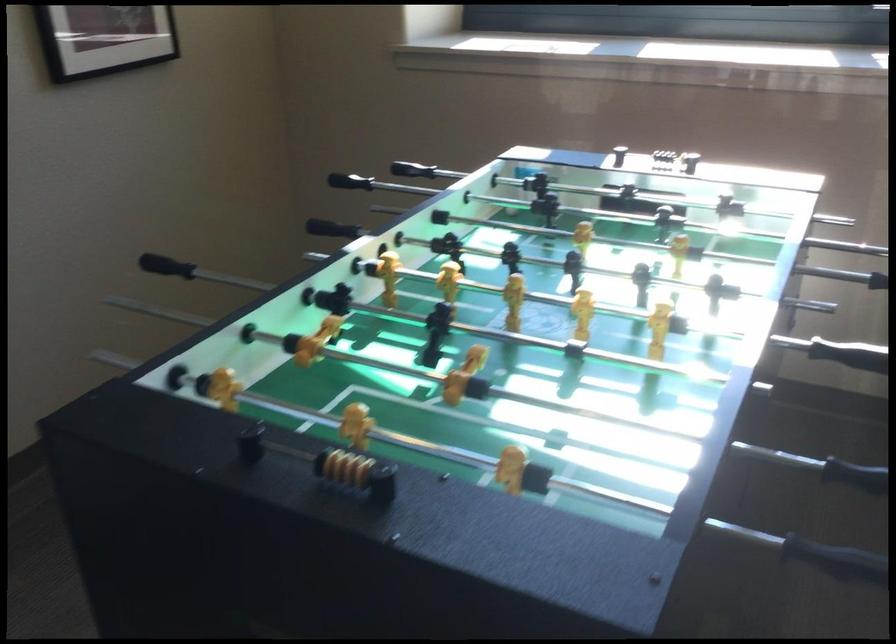
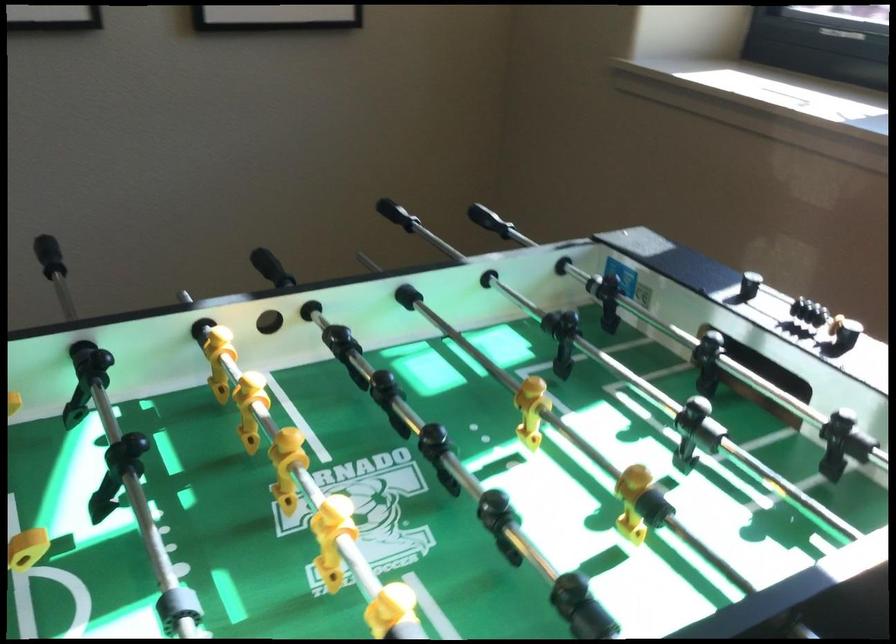
Question: The images are taken continuously from a first-person perspective. In which direction is your viewpoint rotating?

Choices:
 (A) Left
 (B) Right
 (C) Up
 (D) Down

Answer: (A)